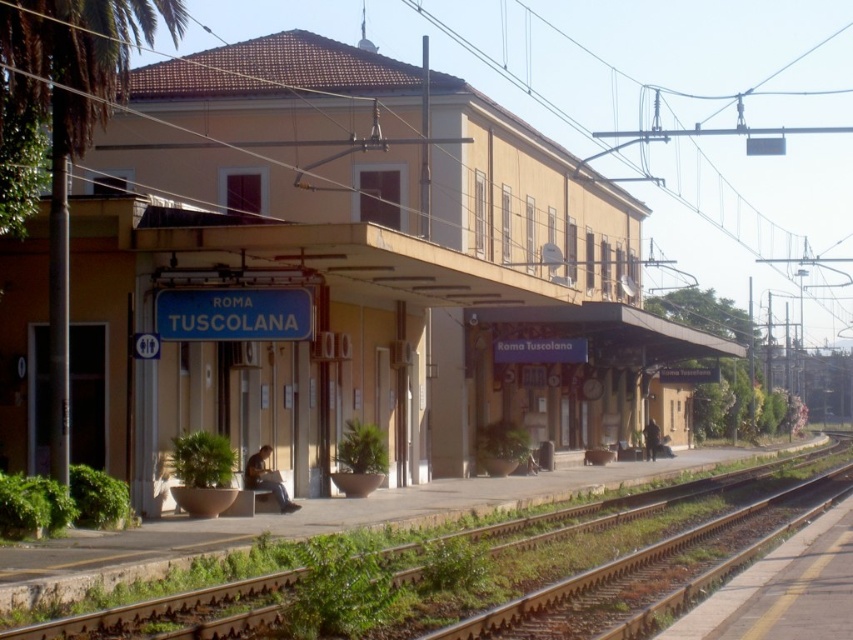
Between yellow matte building at center and green leafy palm tree at left, which one has less height?

With less height is green leafy palm tree at left.

Can you confirm if yellow matte building at center is smaller than green leafy palm tree at left?

No, yellow matte building at center is not smaller than green leafy palm tree at left.

Is point (440, 355) positioned in front of point (83, 20)?

No, it is not.

Identify the location of yellow matte building at center. (347, 272).

Between yellow matte building at center and brown gravel track at lower right, which one is positioned lower?

brown gravel track at lower right is below.

Who is positioned more to the left, yellow matte building at center or brown gravel track at lower right?

Positioned to the left is yellow matte building at center.

Where is `yellow matte building at center`? Image resolution: width=853 pixels, height=640 pixels. yellow matte building at center is located at coordinates (347, 272).

Which is more to the right, green grass at lower left or brown gravel track at lower right?

green grass at lower left

Who is more distant from viewer, (732,541) or (524,627)?

The point (732,541) is behind.

Is point (225, 628) in front of point (601, 605)?

Yes, it is.

This screenshot has height=640, width=853. Identify the location of green grass at lower left. (608, 534).